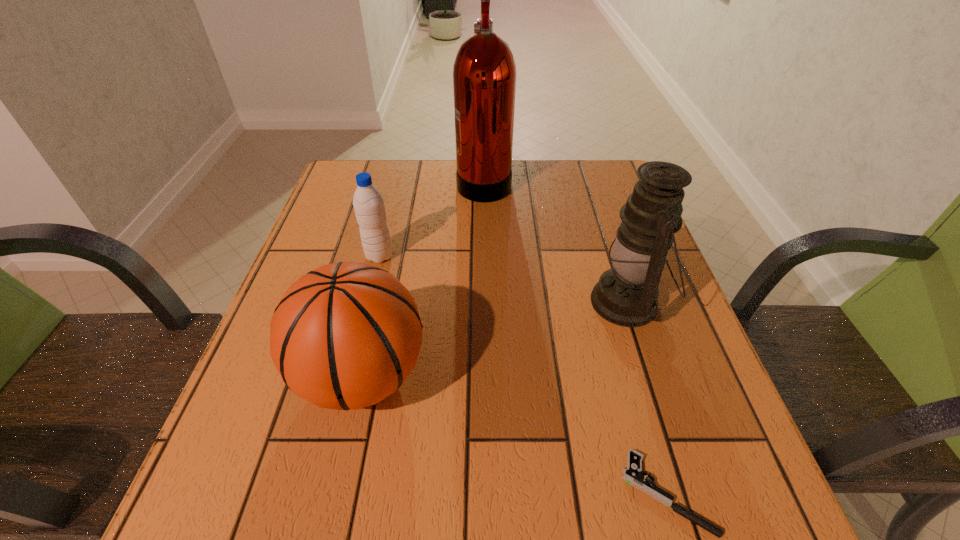
The width and height of the screenshot is (960, 540). Find the location of `oil lamp that is at the right edge`. oil lamp that is at the right edge is located at coordinates (626, 295).

Find the location of a particular element. The height and width of the screenshot is (540, 960). pistol present at the right edge is located at coordinates (632, 475).

Find the location of a particular element. The height and width of the screenshot is (540, 960). object at the near right corner is located at coordinates (632, 475).

You are a GUI agent. You are given a task and a screenshot of the screen. Output one action in this format:
    pyautogui.click(x=<x>, y=<y>)
    Task: Click on the vacant space at the far edge of the desktop
    The height and width of the screenshot is (540, 960).
    Given the screenshot: What is the action you would take?
    [x=540, y=171]

Where is `vacant space at the near edge`? This screenshot has width=960, height=540. vacant space at the near edge is located at coordinates (358, 490).

Locate an element on the screen. free region at the left edge of the desktop is located at coordinates (330, 241).

Locate an element on the screen. Image resolution: width=960 pixels, height=540 pixels. vacant region at the right edge of the desktop is located at coordinates (674, 307).

In the image, there is a desktop. Where is `vacant space at the far right corner`? The height and width of the screenshot is (540, 960). vacant space at the far right corner is located at coordinates (628, 188).

Where is `vacant point at the near right corner`? vacant point at the near right corner is located at coordinates (700, 500).

I want to click on vacant area that lies between the fourth shortest object and the basketball, so click(494, 339).